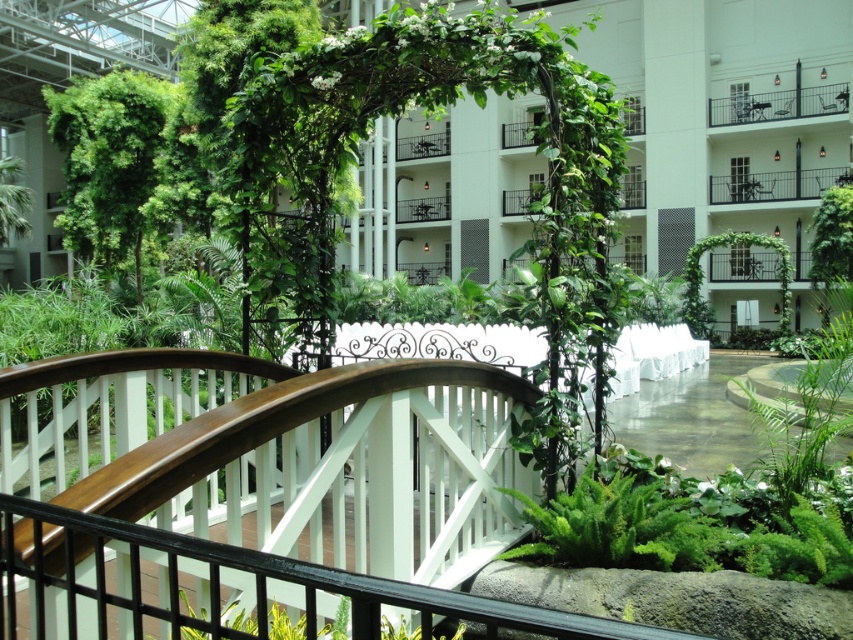
Question: Is white glossy bridge at center below black metal balcony at upper center?

Choices:
 (A) no
 (B) yes

Answer: (A)

Question: Which point is closer to the camera?

Choices:
 (A) (178, 436)
 (B) (740, 180)
 (C) (654, 196)

Answer: (A)

Question: Is white glossy bridge at center further to the viewer compared to black metal balcony at upper center?

Choices:
 (A) no
 (B) yes

Answer: (A)

Question: Which object is farther from the camera taking this photo?

Choices:
 (A) wooden bridge at center
 (B) white glossy bridge at center

Answer: (B)

Question: Which point is farther to the camera?

Choices:
 (A) (700, 120)
 (B) (780, 172)
 (C) (299, 552)

Answer: (A)

Question: Can you confirm if white glossy bridge at center is bigger than wooden bridge at center?

Choices:
 (A) no
 (B) yes

Answer: (B)